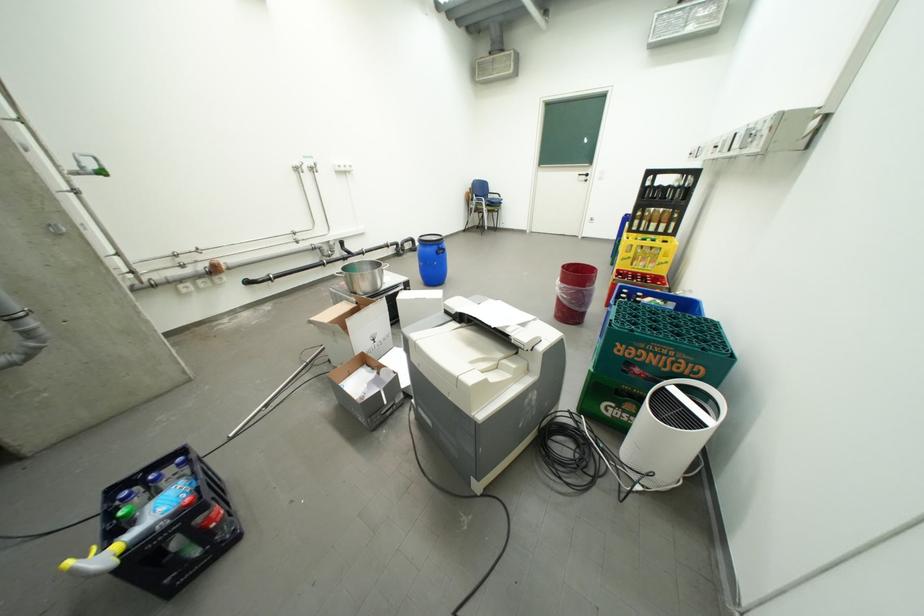
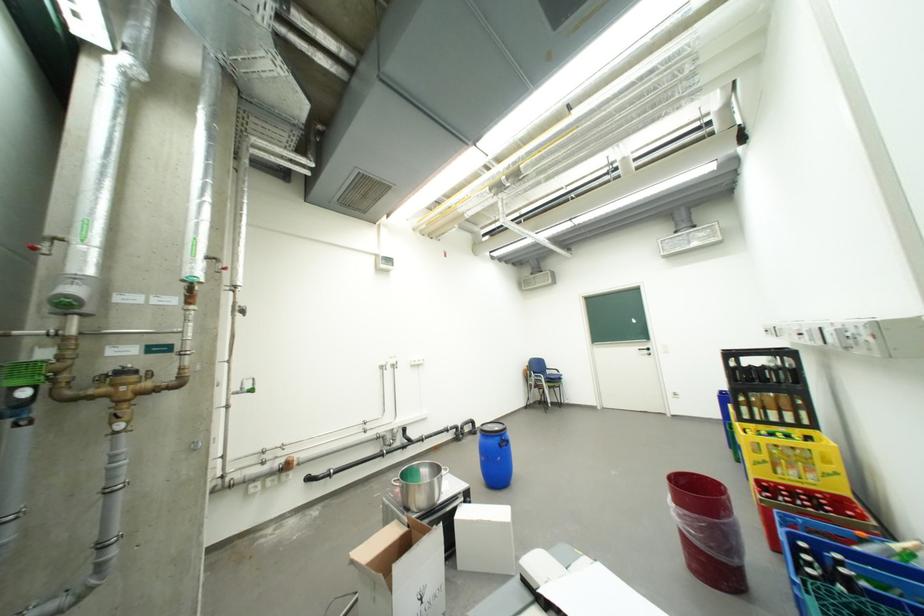
Where in the second image is the point corresponding to point 570,284 from the first image?

(685, 507)